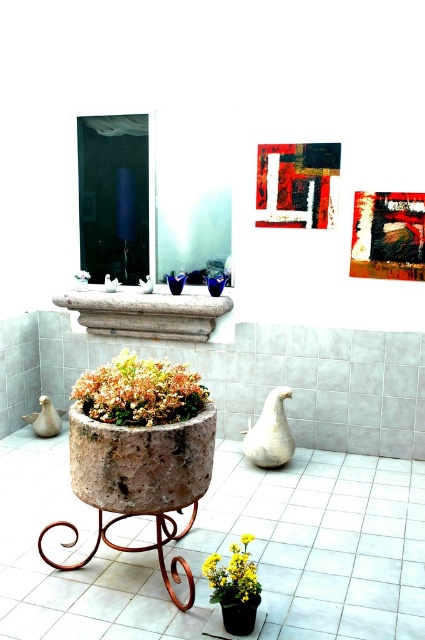
You are standing in the room and want to see the yellow matte flower at lower center clearly. Is it possible to see it without looking past the matte black pot at lower center?

Yes, the yellow matte flower at lower center is in front of the matte black pot at lower center, so you can see it without needing to look past the pot.

You are a delivery person who needs to place a new plant in the space shown. The new plant must be placed between the matte stone pot at center and the matte black pot at lower center. Based on the scene description, is there enough vertical space between these two pots to place the new plant?

The matte stone pot at center is positioned over the matte black pot at lower center, meaning there is no vertical space between them for placing a new plant.